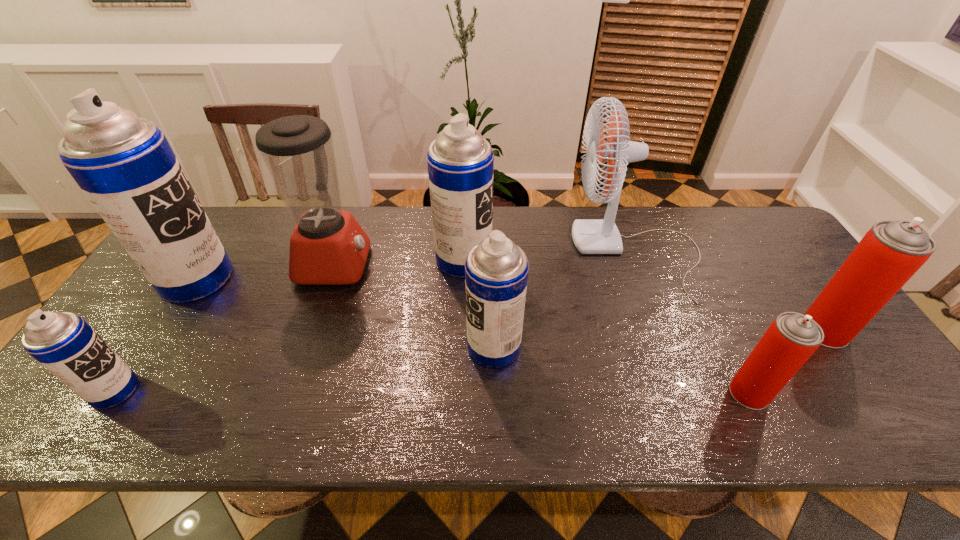
The height and width of the screenshot is (540, 960). I want to click on the tallest aerosol can, so click(123, 163).

Where is `the biggest blue aerosol can`? the biggest blue aerosol can is located at coordinates (123, 163).

I want to click on the second biggest blue aerosol can, so click(460, 162).

What are the coordinates of `fan` in the screenshot? It's located at (591, 236).

What are the coordinates of `the sixth object from right to left` in the screenshot? It's located at (328, 246).

Find the location of a particular element. The width and height of the screenshot is (960, 540). the right red aerosol can is located at coordinates (891, 252).

Where is `the rightmost object`? The height and width of the screenshot is (540, 960). the rightmost object is located at coordinates (891, 252).

At what (x,y) coordinates should I click in order to perform the action: click on the third farthest blue aerosol can. Please return your answer as a coordinate pair (x, y). This screenshot has width=960, height=540. Looking at the image, I should click on (496, 270).

The height and width of the screenshot is (540, 960). What are the coordinates of `the nearer red aerosol can` in the screenshot? It's located at (791, 339).

I want to click on the fifth aerosol can from left to right, so click(791, 339).